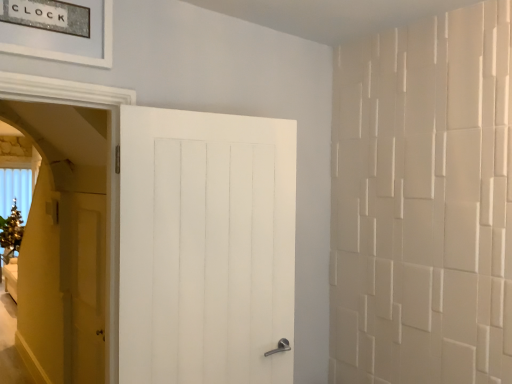
Question: From a real-world perspective, is white wooden door at center, the 1th door in the front-to-back sequence, physically located above or below matte wood door at left, the first door positioned from the back?

Choices:
 (A) above
 (B) below

Answer: (A)

Question: Which is correct: white wooden door at center, the second door viewed from the left, is inside matte wood door at left, the first door positioned from the back, or outside of it?

Choices:
 (A) inside
 (B) outside

Answer: (B)

Question: From their relative heights in the image, would you say white wooden door at center, the first door viewed from the right, is taller or shorter than matte wood door at left, placed as the 2th door when sorted from right to left?

Choices:
 (A) short
 (B) tall

Answer: (B)

Question: From a real-world perspective, is matte wood door at left, which is the first door from left to right, above or below white wooden door at center, the second door viewed from the left?

Choices:
 (A) above
 (B) below

Answer: (B)

Question: Looking at the image, does matte wood door at left, which appears as the 2th door when viewed from the front, seem bigger or smaller compared to white wooden door at center, the second door viewed from the left?

Choices:
 (A) small
 (B) big

Answer: (A)

Question: In the image, is matte wood door at left, which is the first door from left to right, positioned in front of or behind white wooden door at center, which is counted as the 2th door, starting from the back?

Choices:
 (A) behind
 (B) front

Answer: (A)

Question: Considering the relative positions of matte wood door at left, which appears as the 2th door when viewed from the front, and white wooden door at center, the first door viewed from the right, in the image provided, is matte wood door at left, which appears as the 2th door when viewed from the front, to the left or to the right of white wooden door at center, the first door viewed from the right,?

Choices:
 (A) right
 (B) left

Answer: (B)